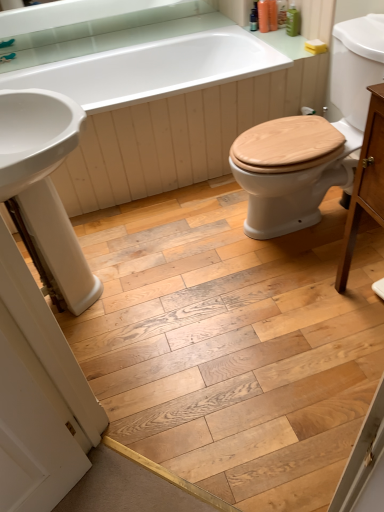
Where is `empty space that is to the right of white glossy sink at left`? empty space that is to the right of white glossy sink at left is located at coordinates (190, 274).